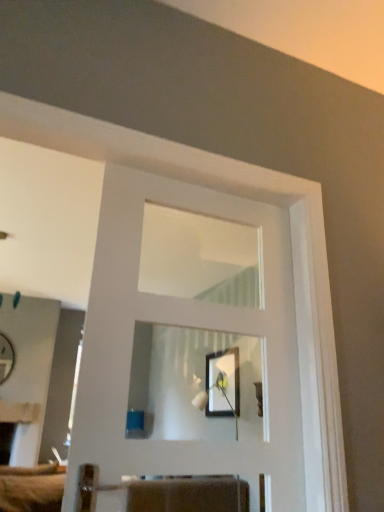
The width and height of the screenshot is (384, 512). I want to click on matte white mirror at left, so click(x=6, y=358).

This screenshot has height=512, width=384. What do you see at coordinates (6, 358) in the screenshot?
I see `matte white mirror at left` at bounding box center [6, 358].

Where is `white glossy door at center`? The height and width of the screenshot is (512, 384). white glossy door at center is located at coordinates (188, 339).

Locate an element on the screen. matte white mirror at left is located at coordinates (6, 358).

Which object is closer to the camera taking this photo, matte black picture frame at center or white glossy door at center?

white glossy door at center is in front.

From the picture: Is matte black picture frame at center positioned with its back to white glossy door at center?

No, matte black picture frame at center's orientation is not away from white glossy door at center.

Which object is wider, matte black picture frame at center or white glossy door at center?

white glossy door at center is wider.

You are a GUI agent. You are given a task and a screenshot of the screen. Output one action in this format:
    pyautogui.click(x=<x>, y=<y>)
    Task: Click on the door that is in front of the matte black picture frame at center
    The image size is (384, 512).
    Given the screenshot: What is the action you would take?
    pyautogui.click(x=188, y=339)

From the image's perspective, does matte white mirror at left appear lower than white glossy door at center?

Yes.

Is white glossy door at center completely or partially inside matte white mirror at left?

No, white glossy door at center is not surrounded by matte white mirror at left.

Is matte white mirror at left oriented away from white glossy door at center?

No, white glossy door at center is not at the back of matte white mirror at left.

Is point (4, 374) farther from viewer compared to point (173, 388)?

No, (4, 374) is in front of (173, 388).

Could you tell me if white glossy door at center is turned towards matte white mirror at left?

Yes, white glossy door at center is oriented towards matte white mirror at left.

Would you consider white glossy door at center to be distant from matte white mirror at left?

Absolutely, white glossy door at center is distant from matte white mirror at left.

Between white glossy door at center and matte white mirror at left, which one has less height?

matte white mirror at left is shorter.

Consider the image. Would you say white glossy door at center is inside or outside matte white mirror at left?

The correct answer is: outside.

Is white glossy door at center completely or partially outside of matte black picture frame at center?

Yes, white glossy door at center is not within matte black picture frame at center.

Is white glossy door at center shorter than matte black picture frame at center?

No, white glossy door at center is not shorter than matte black picture frame at center.

Is white glossy door at center wider than matte black picture frame at center?

Indeed, white glossy door at center has a greater width compared to matte black picture frame at center.

Is white glossy door at center positioned with its back to matte black picture frame at center?

No, white glossy door at center is not facing the opposite direction of matte black picture frame at center.

From a real-world perspective, is matte white mirror at left on matte black picture frame at center?

Yes, from a real-world perspective, matte white mirror at left is over matte black picture frame at center

From the image's perspective, does matte white mirror at left appear lower than matte black picture frame at center?

Yes.

Does matte white mirror at left come in front of matte black picture frame at center?

That is False.

Is matte white mirror at left wider than matte black picture frame at center?

Yes, matte white mirror at left is wider than matte black picture frame at center.

Is matte black picture frame at center far from matte white mirror at left?

Yes, matte black picture frame at center and matte white mirror at left are quite far apart.

Considering the positions of objects matte black picture frame at center and matte white mirror at left in the image provided, who is more to the left, matte black picture frame at center or matte white mirror at left?

matte white mirror at left.

What's the angular difference between matte black picture frame at center and matte white mirror at left's facing directions?

They differ by 92.2 degrees in their facing directions.

Looking at this image, between matte black picture frame at center and matte white mirror at left, which one is positioned in front?

matte black picture frame at center.

This screenshot has width=384, height=512. Identify the location of picture frame on the right of white glossy door at center. (223, 383).

Find the location of a particular element. The image size is (384, 512). door above the matte white mirror at left (from the image's perspective) is located at coordinates (188, 339).

Which object lies nearer to the anchor point matte black picture frame at center, white glossy door at center or matte white mirror at left?

white glossy door at center is positioned closer to the anchor matte black picture frame at center.

Which object lies nearer to the anchor point matte black picture frame at center, matte white mirror at left or white glossy door at center?

white glossy door at center is positioned closer to the anchor matte black picture frame at center.

Considering their positions, is matte black picture frame at center positioned closer to white glossy door at center than matte white mirror at left?

matte black picture frame at center is positioned closer to the anchor white glossy door at center.

From the picture: From the image, which object appears to be nearer to matte white mirror at left, white glossy door at center or matte black picture frame at center?

white glossy door at center is positioned closer to the anchor matte white mirror at left.

When comparing their distances from matte white mirror at left, does matte black picture frame at center or white glossy door at center seem closer?

Among the two, white glossy door at center is located nearer to matte white mirror at left.

Based on their spatial positions, is matte white mirror at left or matte black picture frame at center closer to white glossy door at center?

matte black picture frame at center lies closer to white glossy door at center than the other object.

I want to click on picture frame between white glossy door at center and matte white mirror at left from front to back, so click(x=223, y=383).